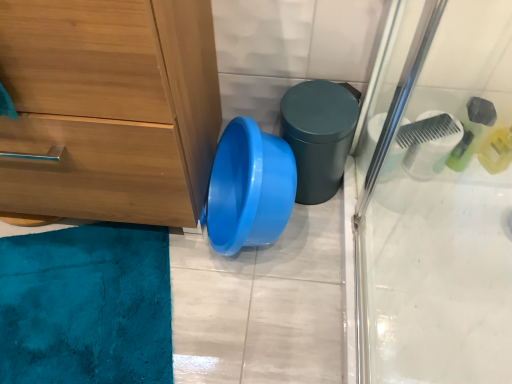
Find the location of `free spot above matte green potty at center (from a real-world perspective)`. free spot above matte green potty at center (from a real-world perspective) is located at coordinates (317, 106).